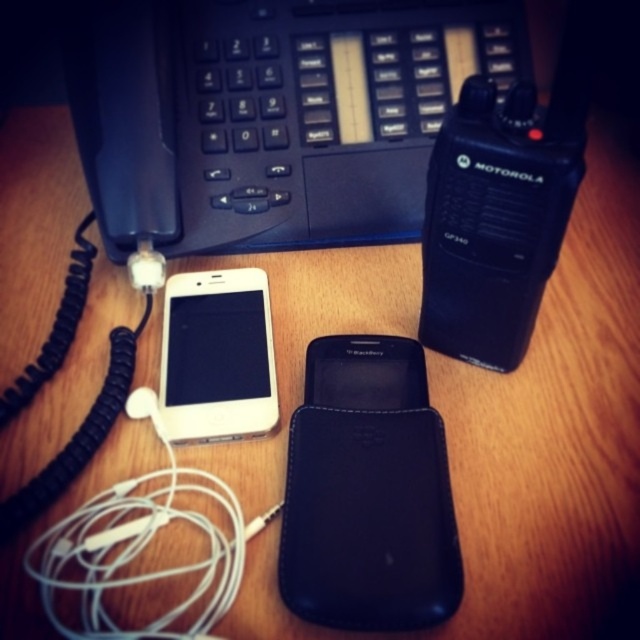
In the scene shown: Who is positioned more to the left, black plastic keyboard at upper center or white glossy ipod at center?

white glossy ipod at center

From the picture: Is black plastic keyboard at upper center below white glossy ipod at center?

Actually, black plastic keyboard at upper center is above white glossy ipod at center.

Is point (298, 147) farther from camera compared to point (202, 337)?

That is True.

Identify the location of black plastic keyboard at upper center. The height and width of the screenshot is (640, 640). (269, 116).

Is white glossy ipod at center thinner than black matte/blackberry at center?

In fact, white glossy ipod at center might be wider than black matte/blackberry at center.

What are the coordinates of `white glossy ipod at center` in the screenshot? It's located at (218, 356).

Is point (209, 106) positioned before point (394, 376)?

No.

In order to click on black plastic keyboard at upper center in this screenshot , I will do `click(269, 116)`.

Find the location of a particular element. This screenshot has width=640, height=640. black plastic keyboard at upper center is located at coordinates (269, 116).